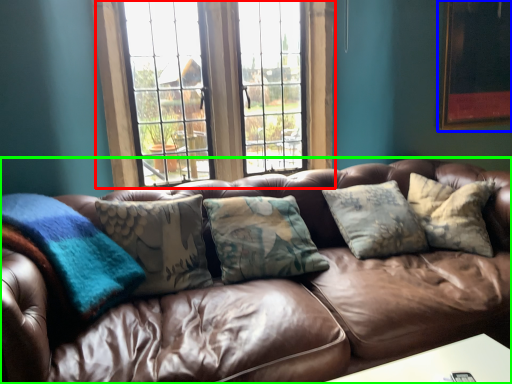
Question: Which is nearer to the window (highlighted by a red box)? picture frame (highlighted by a blue box) or studio couch (highlighted by a green box).

Choices:
 (A) picture frame
 (B) studio couch

Answer: (B)